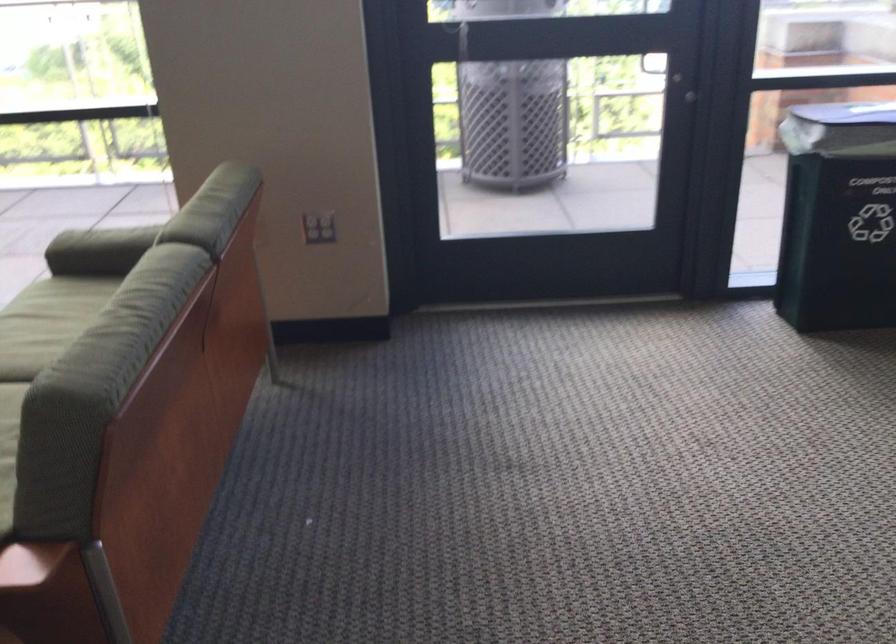
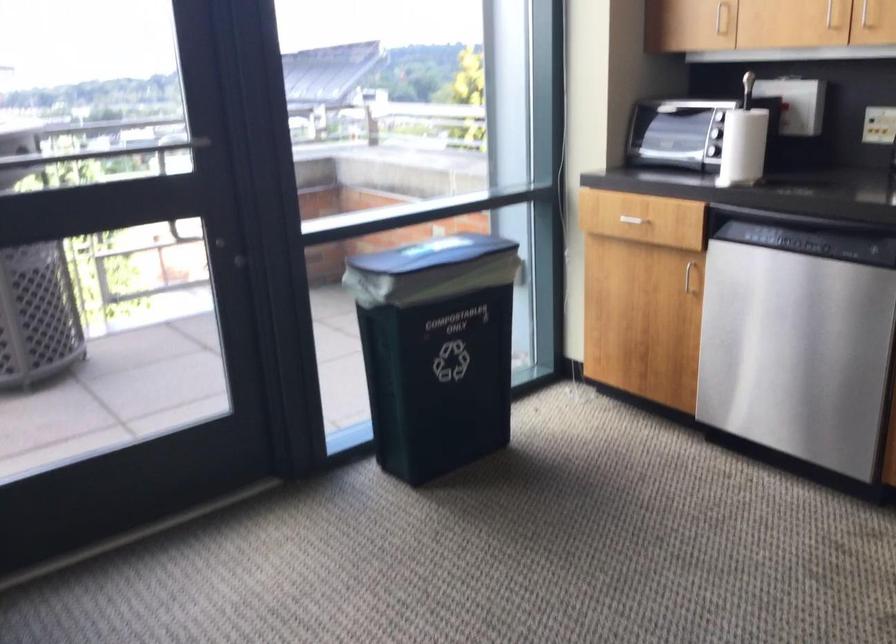
Question: Based on the continuous images, in which direction is the camera rotating? Reply with the corresponding letter.

Choices:
 (A) Left
 (B) Right
 (C) Up
 (D) Down

Answer: (B)